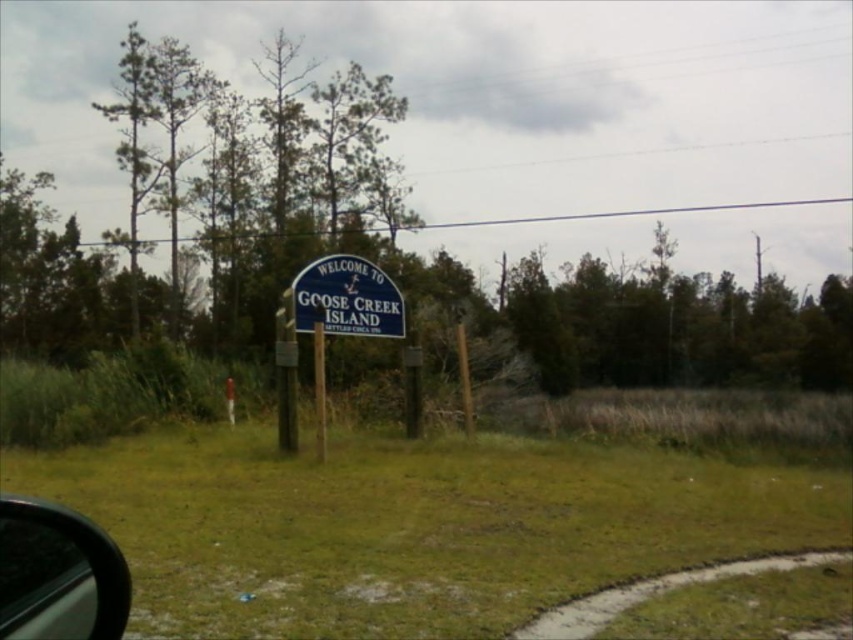
You are driving a car and see the blue painted wood sign at center and the wooden post at center. Which object is closer to you?

The blue painted wood sign at center is closer to you because the wooden post at center is behind it.

You are a delivery person who needs to attach a package to the wooden post at center. The package is 1.2 meters long. Can you attach it to the post without the package overlapping with the blue painted wood sign at center?

The blue painted wood sign at center is 1.09 meters away from wooden post at center. Since the package is 1.2 meters long, which is longer than the distance between the sign and the post, attaching it would cause the package to overlap with the blue painted wood sign at center.